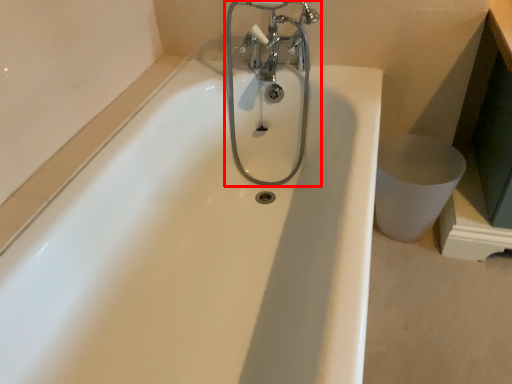
Question: Observing the image, what is the correct spatial positioning of tap (annotated by the red box) in reference to toilet bowl?

Choices:
 (A) right
 (B) left

Answer: (B)